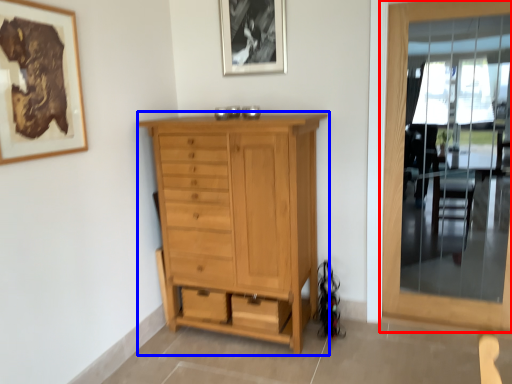
Question: Which point is closer to the camera, door (highlighted by a red box) or chest of drawers (highlighted by a blue box)?

Choices:
 (A) door
 (B) chest of drawers

Answer: (B)